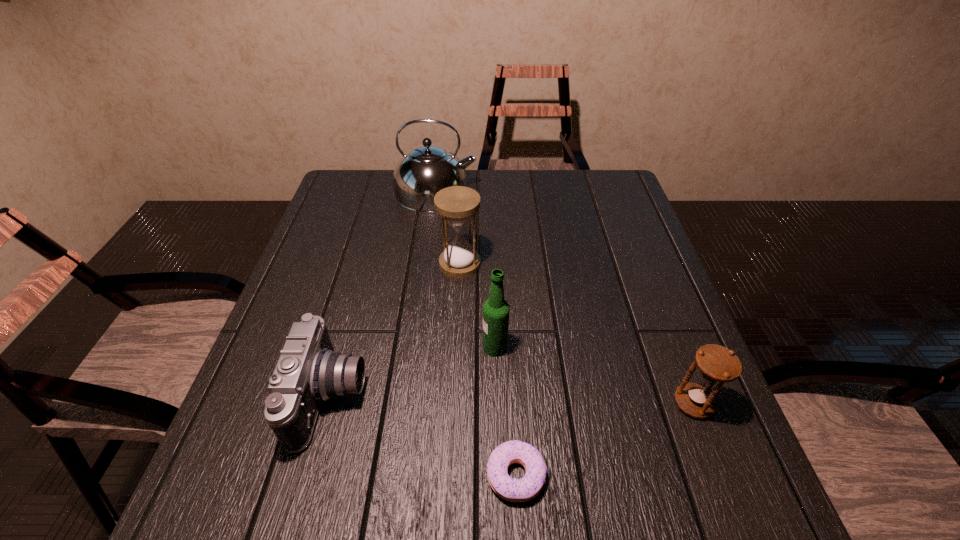
Locate an element on the screen. The width and height of the screenshot is (960, 540). vacant position in the image that satisfies the following two spatial constraints: 1. on the front side of the fifth nearest object; 2. on the right side of the nearer hourglass is located at coordinates (453, 403).

Find the location of `vacant point that satisfies the following two spatial constraints: 1. on the front side of the rightmost object; 2. on the right side of the taller hourglass`. vacant point that satisfies the following two spatial constraints: 1. on the front side of the rightmost object; 2. on the right side of the taller hourglass is located at coordinates (453, 403).

The height and width of the screenshot is (540, 960). Find the location of `free space that satisfies the following two spatial constraints: 1. on the back side of the shortest object; 2. on the front-facing side of the camera`. free space that satisfies the following two spatial constraints: 1. on the back side of the shortest object; 2. on the front-facing side of the camera is located at coordinates (511, 396).

What are the coordinates of `free location that satisfies the following two spatial constraints: 1. on the label of the shortest object; 2. on the left side of the beer bottle` in the screenshot? It's located at (498, 475).

The image size is (960, 540). Find the location of `free location that satisfies the following two spatial constraints: 1. on the front-facing side of the right hourglass; 2. on the left side of the camera`. free location that satisfies the following two spatial constraints: 1. on the front-facing side of the right hourglass; 2. on the left side of the camera is located at coordinates (330, 403).

Find the location of a particular element. Image resolution: width=960 pixels, height=540 pixels. free space that satisfies the following two spatial constraints: 1. on the front-facing side of the right hourglass; 2. on the right side of the camera is located at coordinates (330, 403).

What are the coordinates of `free space that satisfies the following two spatial constraints: 1. on the front-facing side of the nearer hourglass; 2. on the left side of the camera` in the screenshot? It's located at (330, 403).